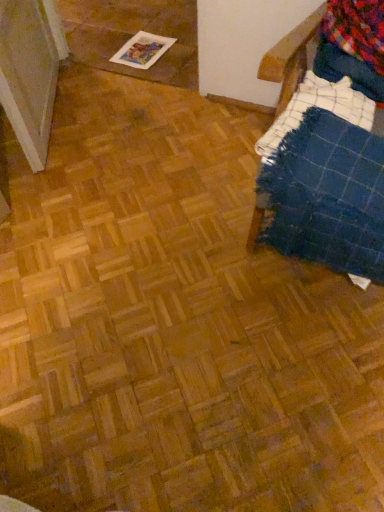
This screenshot has height=512, width=384. Find the location of `vacant space to the left of printed paper magazine at upper left`. vacant space to the left of printed paper magazine at upper left is located at coordinates (105, 49).